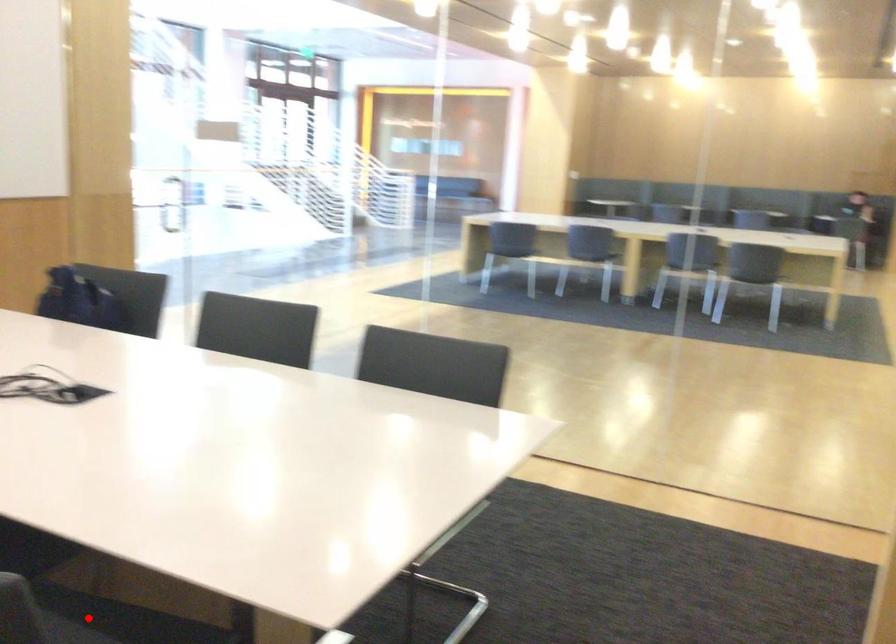
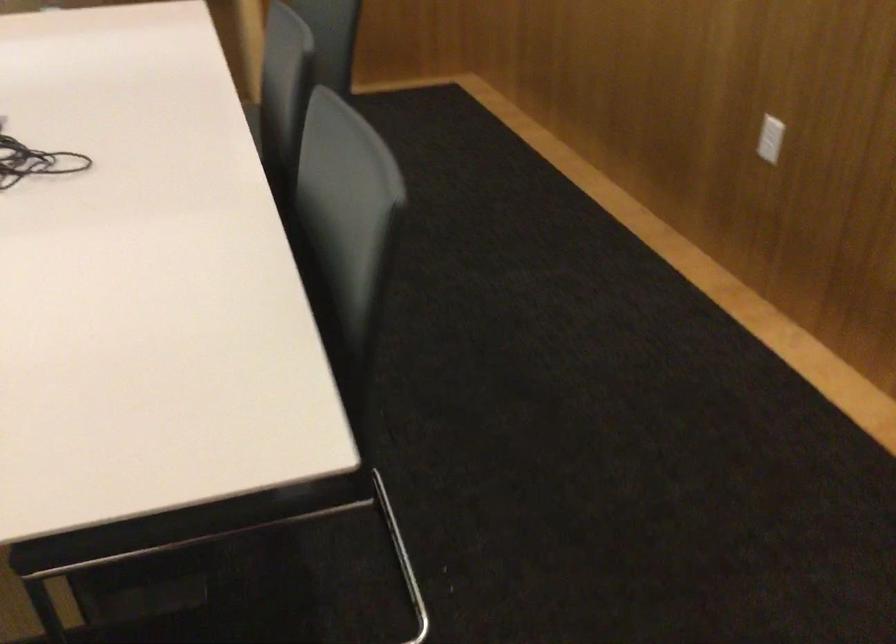
Question: I am providing you with two images of the same scene from different viewpoints. A red point is marked on the first image. Can you still see the location of the red point in image 2?

Choices:
 (A) Yes
 (B) No

Answer: (B)